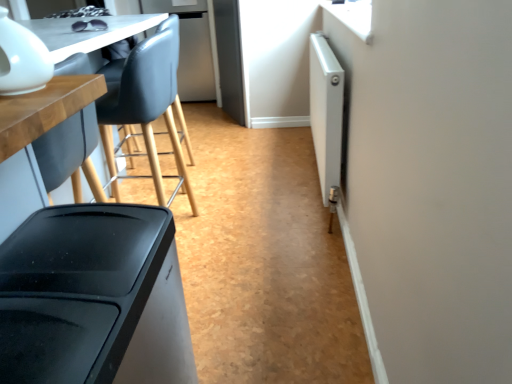
Where is `white metallic radiator at right, the first appliance from the back`? The height and width of the screenshot is (384, 512). white metallic radiator at right, the first appliance from the back is located at coordinates (326, 112).

The width and height of the screenshot is (512, 384). I want to click on white glossy teapot at upper left, which is counted as the 1th appliance, starting from the left, so click(22, 59).

From the image's perspective, is matte wood table at left under white metallic radiator at right, placed as the 2th appliance when sorted from front to back?

Indeed, from the image's perspective, matte wood table at left is shown beneath white metallic radiator at right, placed as the 2th appliance when sorted from front to back.

Is matte wood table at left directly adjacent to white metallic radiator at right, the first appliance from the back?

No, matte wood table at left is not touching white metallic radiator at right, the first appliance from the back.

Looking at the image, does matte wood table at left seem bigger or smaller compared to white metallic radiator at right, which is the 2th appliance from left to right?

matte wood table at left is bigger than white metallic radiator at right, which is the 2th appliance from left to right.

Considering the sizes of objects matte wood table at left and white metallic radiator at right, which is the first appliance in right-to-left order, in the image provided, who is wider, matte wood table at left or white metallic radiator at right, which is the first appliance in right-to-left order,?

matte wood table at left.

Looking at the image, does white metallic radiator at right, which is the first appliance in right-to-left order, seem bigger or smaller compared to white glossy teapot at upper left, which is counted as the 1th appliance, starting from the left?

Clearly, white metallic radiator at right, which is the first appliance in right-to-left order, is larger in size than white glossy teapot at upper left, which is counted as the 1th appliance, starting from the left.

Does white metallic radiator at right, placed as the 2th appliance when sorted from front to back, come behind white glossy teapot at upper left, which is counted as the 1th appliance, starting from the left?

Yes, the depth of white metallic radiator at right, placed as the 2th appliance when sorted from front to back, is greater than that of white glossy teapot at upper left, which is counted as the 1th appliance, starting from the left.

Is point (336, 101) farther from camera compared to point (21, 44)?

Yes.

Which is correct: white metallic radiator at right, placed as the 2th appliance when sorted from front to back, is inside white glossy teapot at upper left, which is counted as the 1th appliance, starting from the left, or outside of it?

white metallic radiator at right, placed as the 2th appliance when sorted from front to back, is outside white glossy teapot at upper left, which is counted as the 1th appliance, starting from the left.

Considering the relative positions of white metallic radiator at right, the first appliance from the back, and matte wood table at left in the image provided, is white metallic radiator at right, the first appliance from the back, behind matte wood table at left?

Yes, white metallic radiator at right, the first appliance from the back, is further from the camera.

Considering the sizes of objects white metallic radiator at right, the first appliance from the back, and matte wood table at left in the image provided, who is shorter, white metallic radiator at right, the first appliance from the back, or matte wood table at left?

white metallic radiator at right, the first appliance from the back, is shorter.

Image resolution: width=512 pixels, height=384 pixels. I want to click on table that is on the left side of white metallic radiator at right, placed as the 2th appliance when sorted from front to back, so click(x=154, y=329).

Can you tell me how much white glossy teapot at upper left, the second appliance viewed from the right, and white metallic radiator at right, the first appliance from the back, differ in facing direction?

They differ by 73.8 degrees in their facing directions.

Is point (18, 40) less distant than point (337, 115)?

Yes, point (18, 40) is in front of point (337, 115).

Which object is closer to the camera taking this photo, white glossy teapot at upper left, which is counted as the 1th appliance, starting from the left, or white metallic radiator at right, placed as the 2th appliance when sorted from front to back?

white glossy teapot at upper left, which is counted as the 1th appliance, starting from the left.

From the image's perspective, which is below, white glossy teapot at upper left, which is counted as the 1th appliance, starting from the left, or white metallic radiator at right, which is the 2th appliance from left to right?

white glossy teapot at upper left, which is counted as the 1th appliance, starting from the left, is shown below in the image.

Which object is positioned more to the right, white glossy teapot at upper left, marked as the first appliance in a front-to-back arrangement, or matte wood table at left?

Positioned to the right is white glossy teapot at upper left, marked as the first appliance in a front-to-back arrangement.

Considering the relative sizes of white glossy teapot at upper left, which is counted as the 1th appliance, starting from the left, and matte wood table at left in the image provided, is white glossy teapot at upper left, which is counted as the 1th appliance, starting from the left, bigger than matte wood table at left?

No.

In the scene shown: From the image's perspective, relative to matte wood table at left, is white glossy teapot at upper left, marked as the first appliance in a front-to-back arrangement, above or below?

From the image's perspective, white glossy teapot at upper left, marked as the first appliance in a front-to-back arrangement, appears above matte wood table at left.

From a real-world perspective, who is located higher, white glossy teapot at upper left, which is the 2th appliance in back-to-front order, or matte wood table at left?

white glossy teapot at upper left, which is the 2th appliance in back-to-front order, is physically above.

Considering the relative positions of matte wood table at left and white glossy teapot at upper left, the second appliance viewed from the right, in the image provided, is matte wood table at left behind white glossy teapot at upper left, the second appliance viewed from the right,?

No, matte wood table at left is closer to the camera.

From the picture: How much distance is there between matte wood table at left and white glossy teapot at upper left, which is counted as the 1th appliance, starting from the left?

They are 12.70 inches apart.

Is matte wood table at left oriented away from white glossy teapot at upper left, the second appliance viewed from the right?

That's not correct — matte wood table at left is not looking away from white glossy teapot at upper left, the second appliance viewed from the right.

From the image's perspective, is matte wood table at left on top of white glossy teapot at upper left, marked as the first appliance in a front-to-back arrangement?

No, from the image's perspective, matte wood table at left is not above white glossy teapot at upper left, marked as the first appliance in a front-to-back arrangement.

The width and height of the screenshot is (512, 384). Find the location of `the 2nd appliance positioned above the matte wood table at left (from the image's perspective)`. the 2nd appliance positioned above the matte wood table at left (from the image's perspective) is located at coordinates (326, 112).

The width and height of the screenshot is (512, 384). Find the location of `appliance directly beneath the white glossy teapot at upper left, which is counted as the 1th appliance, starting from the left (from a real-world perspective)`. appliance directly beneath the white glossy teapot at upper left, which is counted as the 1th appliance, starting from the left (from a real-world perspective) is located at coordinates (326, 112).

From the image, which object appears to be farther from white metallic radiator at right, which is the first appliance in right-to-left order, white glossy teapot at upper left, the second appliance viewed from the right, or matte wood table at left?

white glossy teapot at upper left, the second appliance viewed from the right.

When comparing their distances from white glossy teapot at upper left, which is the 2th appliance in back-to-front order, does white metallic radiator at right, the first appliance from the back, or matte wood table at left seem further?

white metallic radiator at right, the first appliance from the back, is further to white glossy teapot at upper left, which is the 2th appliance in back-to-front order.

Which object lies further to the anchor point white metallic radiator at right, which is the first appliance in right-to-left order, matte wood table at left or white glossy teapot at upper left, which is the 2th appliance in back-to-front order?

Based on the image, white glossy teapot at upper left, which is the 2th appliance in back-to-front order, appears to be further to white metallic radiator at right, which is the first appliance in right-to-left order.

In the scene shown: Looking at the image, which one is located closer to matte wood table at left, white glossy teapot at upper left, which is counted as the 1th appliance, starting from the left, or white metallic radiator at right, which is the 2th appliance from left to right?

white glossy teapot at upper left, which is counted as the 1th appliance, starting from the left.

Looking at the image, which one is located closer to white glossy teapot at upper left, the second appliance viewed from the right, matte wood table at left or white metallic radiator at right, which is the first appliance in right-to-left order?

Based on the image, matte wood table at left appears to be nearer to white glossy teapot at upper left, the second appliance viewed from the right.

Considering their positions, is white metallic radiator at right, placed as the 2th appliance when sorted from front to back, positioned closer to matte wood table at left than white glossy teapot at upper left, the second appliance viewed from the right?

white glossy teapot at upper left, the second appliance viewed from the right.

Find the location of a particular element. The width and height of the screenshot is (512, 384). appliance between matte wood table at left and white metallic radiator at right, which is the 2th appliance from left to right, in the front-back direction is located at coordinates (22, 59).